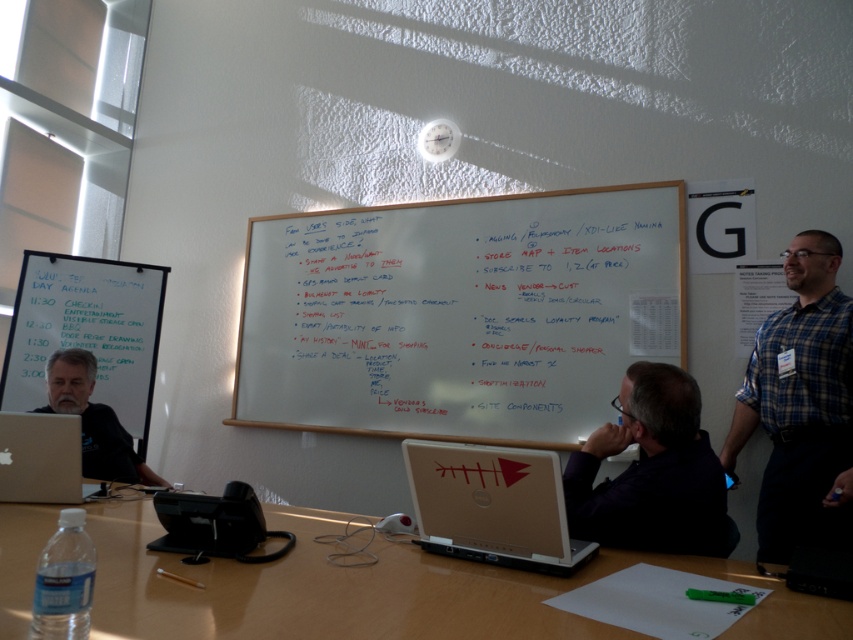
Question: Does smooth wooden table at center have a greater width compared to white matte laptop at center?

Choices:
 (A) yes
 (B) no

Answer: (A)

Question: Can you confirm if smooth wooden table at center is smaller than silver metallic laptop at lower left?

Choices:
 (A) yes
 (B) no

Answer: (B)

Question: Which point is farther from the camera taking this photo?

Choices:
 (A) [x=67, y=401]
 (B) [x=405, y=577]
 (C) [x=584, y=563]
 (D) [x=39, y=486]

Answer: (A)

Question: Is blue plaid shirt at right below matte black laptop at left?

Choices:
 (A) no
 (B) yes

Answer: (A)

Question: Which point is farther to the camera?

Choices:
 (A) white matte laptop at center
 (B) dark blue shirt at center
 (C) smooth wooden table at center
 (D) whiteboard at upper left

Answer: (D)

Question: Which object is positioned farthest from the whiteboard at center?

Choices:
 (A) smooth wooden table at center
 (B) white matte laptop at center

Answer: (B)